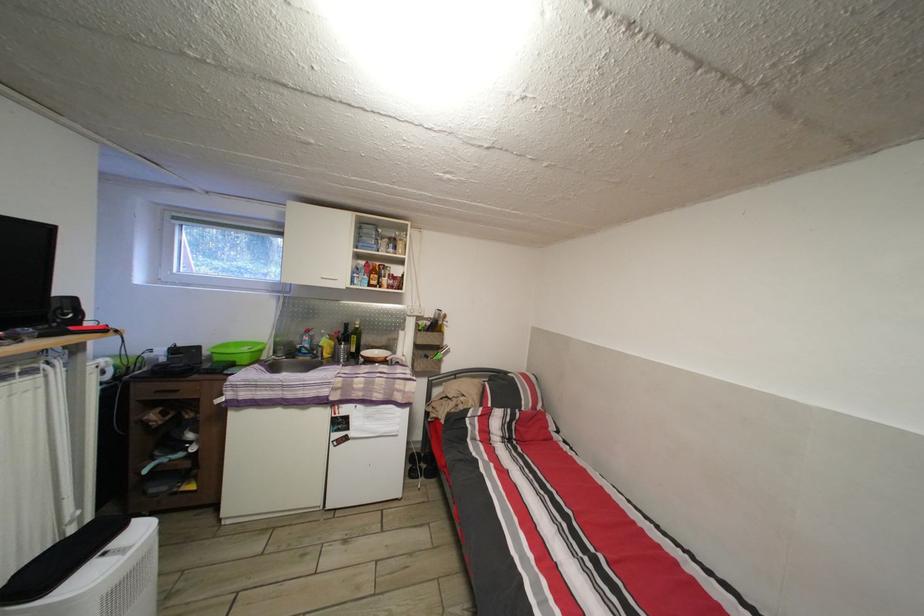
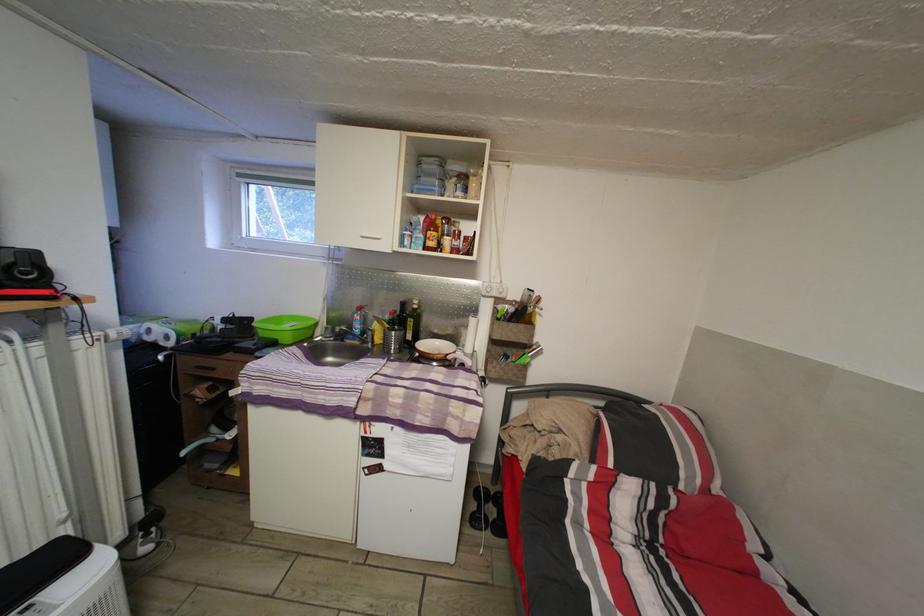
In the second image, find the point that corresponds to (x=205, y=354) in the first image.

(257, 326)